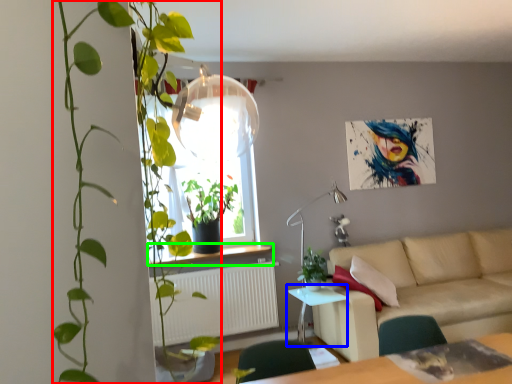
Question: Which is farther away from houseplant (highlighted by a red box)? table (highlighted by a blue box) or window sill (highlighted by a green box)?

Choices:
 (A) table
 (B) window sill

Answer: (A)